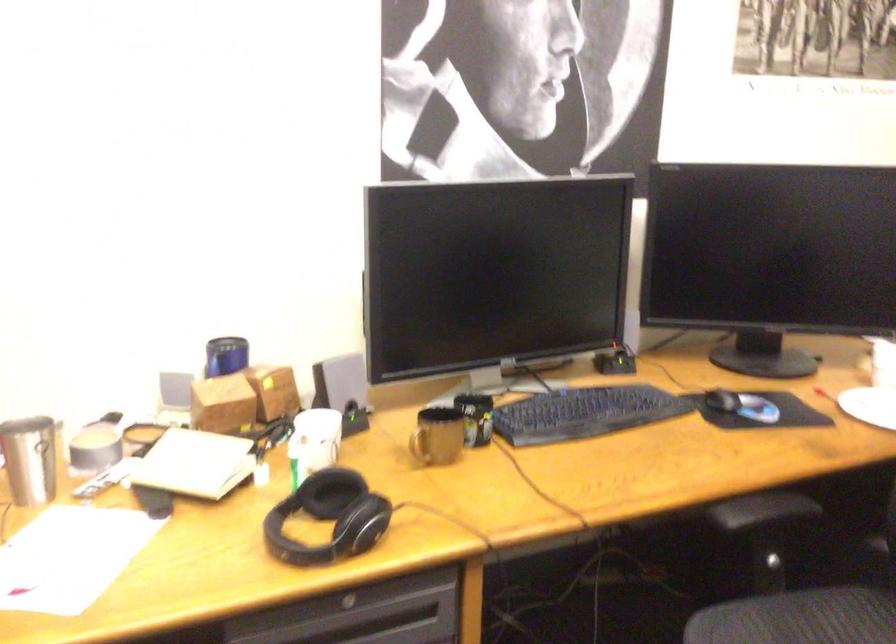
Where would you lift the silver metal cup? Please return your answer as a coordinate pair (x, y).

(30, 459)